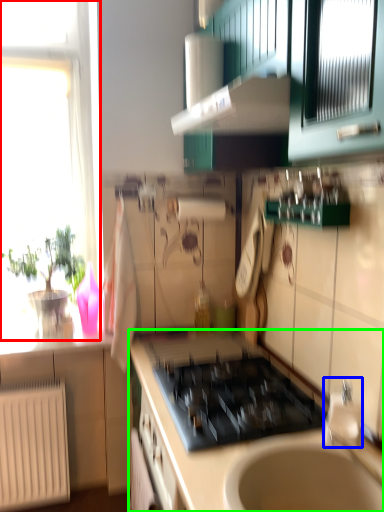
Question: Which is nearer to the window (highlighted by a red box)? faucet (highlighted by a blue box) or countertop (highlighted by a green box).

Choices:
 (A) faucet
 (B) countertop

Answer: (B)